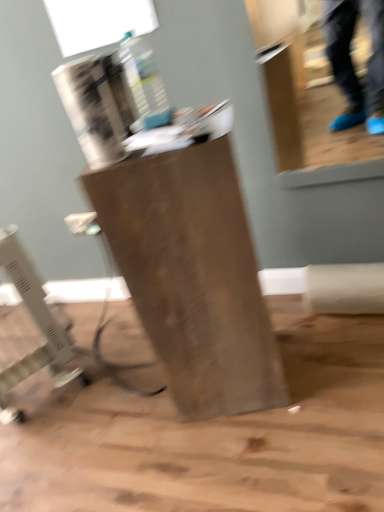
Find the location of a particular element. This screenshot has height=512, width=384. matte brown cabinet at center is located at coordinates (192, 275).

What is the approximate width of matte brown cabinet at center?

matte brown cabinet at center is 12.60 inches wide.

What do you see at coordinates (192, 275) in the screenshot?
I see `matte brown cabinet at center` at bounding box center [192, 275].

Identify the location of matte brown cabinet at center. This screenshot has height=512, width=384. (192, 275).